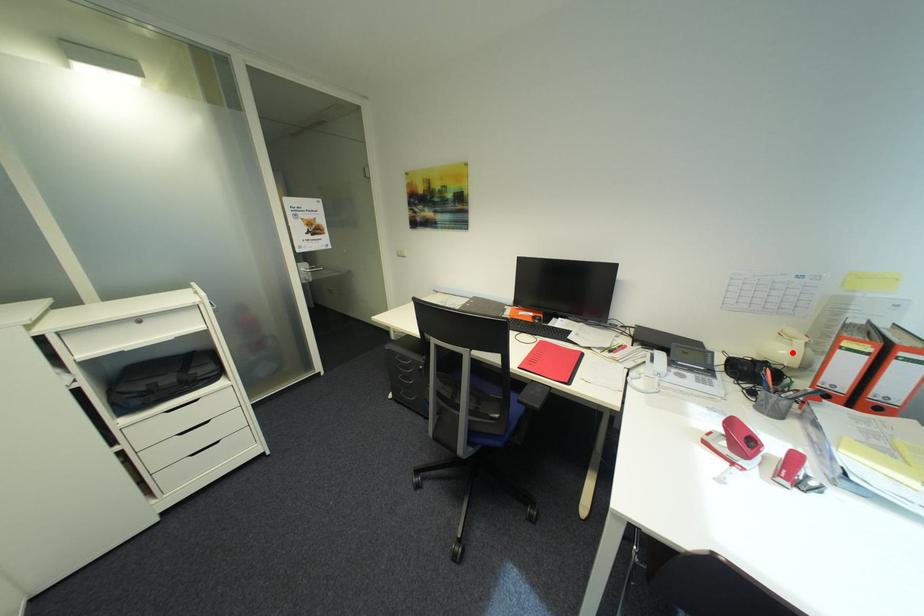
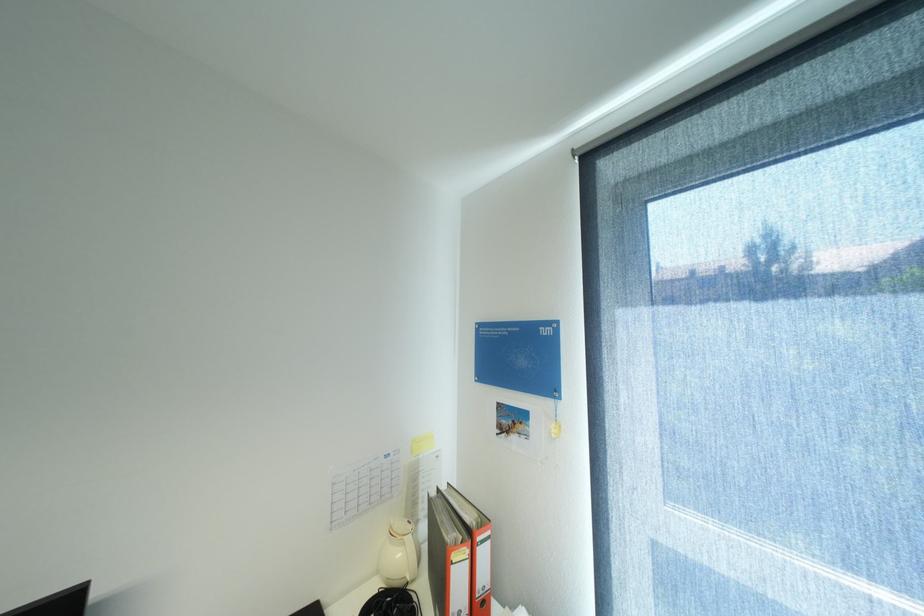
Locate, in the second image, the point that corresponds to the highlighted location in the first image.

(407, 554)